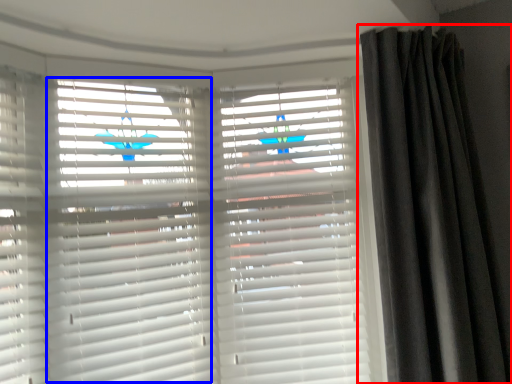
Question: Which object is further to the camera taking this photo, curtain (highlighted by a red box) or shutter (highlighted by a blue box)?

Choices:
 (A) curtain
 (B) shutter

Answer: (B)